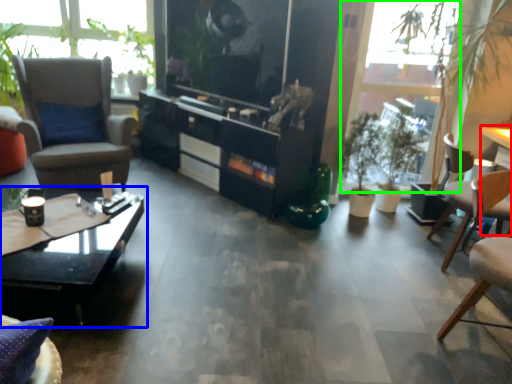
Question: Which object is the farthest from table (highlighted by a red box)? Choose among these: coffee table (highlighted by a blue box) or window screen (highlighted by a green box).

Choices:
 (A) coffee table
 (B) window screen

Answer: (A)